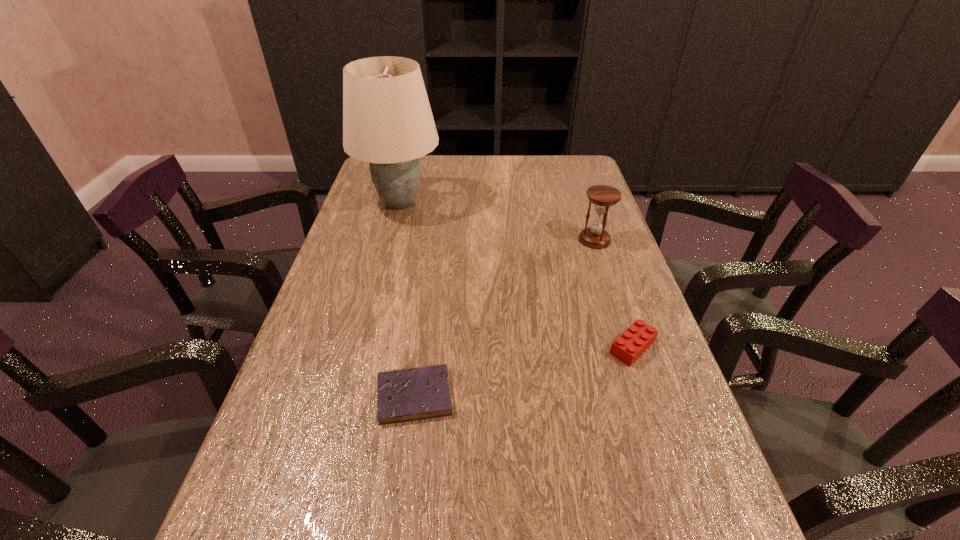
This screenshot has width=960, height=540. In order to click on the farthest object in this screenshot , I will do `click(387, 120)`.

Locate an element on the screen. The height and width of the screenshot is (540, 960). lampshade is located at coordinates (387, 120).

This screenshot has height=540, width=960. I want to click on hourglass, so [x=603, y=196].

The height and width of the screenshot is (540, 960). I want to click on the third shortest object, so click(603, 196).

Identify the location of Lego. (633, 342).

Identify the location of the third farthest object. This screenshot has height=540, width=960. (633, 342).

What are the coordinates of `the nearest object` in the screenshot? It's located at (419, 393).

Identify the location of the shortest object. 419,393.

You are a GUI agent. You are given a task and a screenshot of the screen. Output one action in this format:
    pyautogui.click(x=<x>, y=<y>)
    Task: Click on the vacant space located on the back of the tallest object
    
    Given the screenshot: What is the action you would take?
    pyautogui.click(x=408, y=168)

You are a GUI agent. You are given a task and a screenshot of the screen. Output one action in this format:
    pyautogui.click(x=<x>, y=<y>)
    Task: Click on the free space located on the left of the second tallest object
    
    Given the screenshot: What is the action you would take?
    pyautogui.click(x=536, y=240)